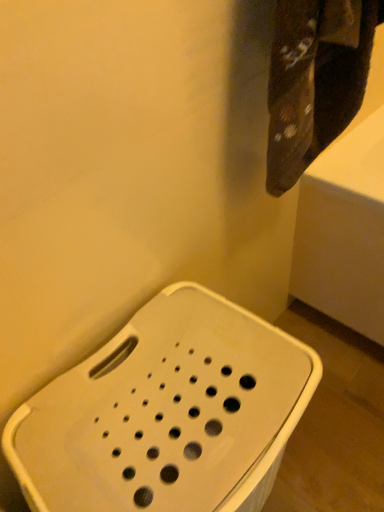
Find the location of a particular element. Image resolution: width=384 pixels, height=512 pixels. blank space situated above white plastic stool at lower left (from a real-world perspective) is located at coordinates (161, 398).